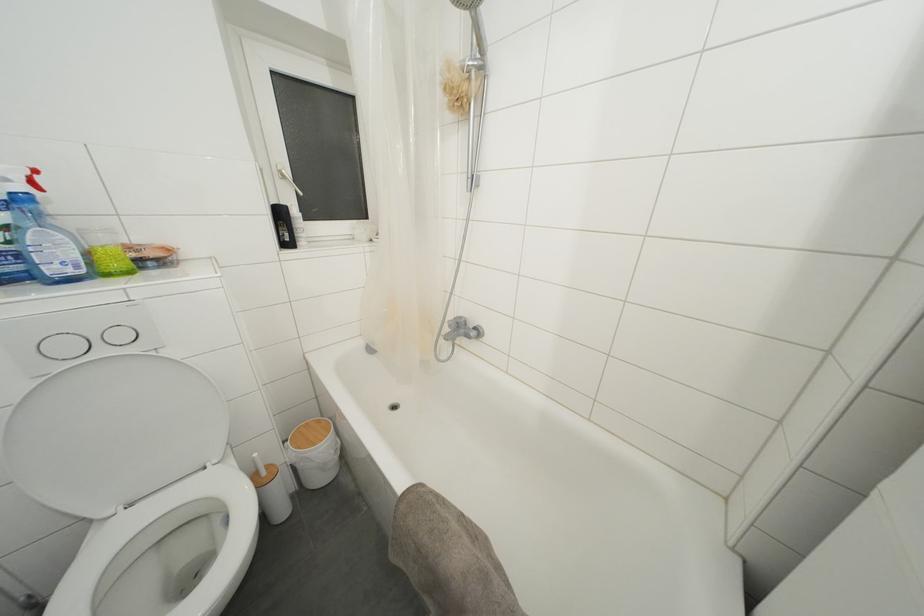
Image resolution: width=924 pixels, height=616 pixels. I want to click on white toilet lid, so click(x=113, y=432).